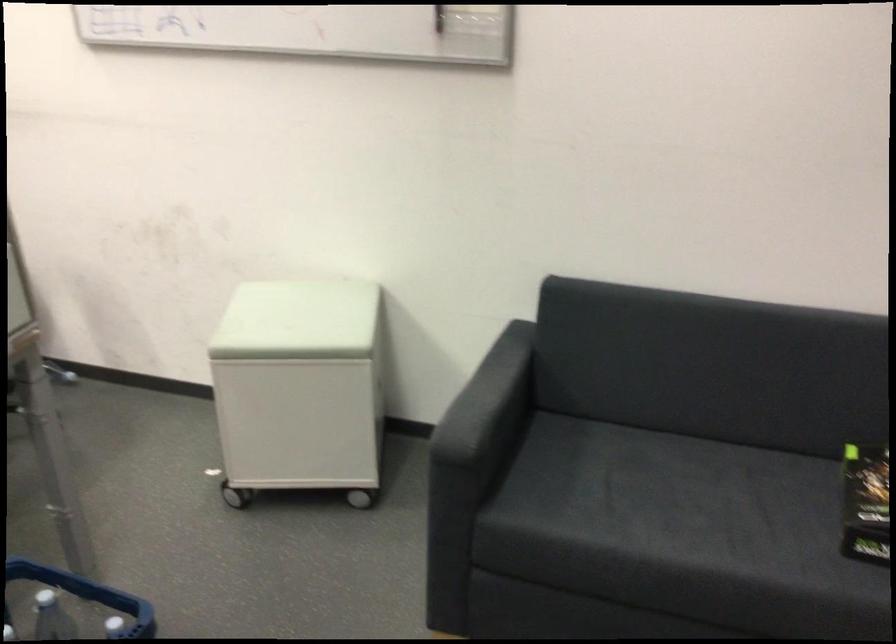
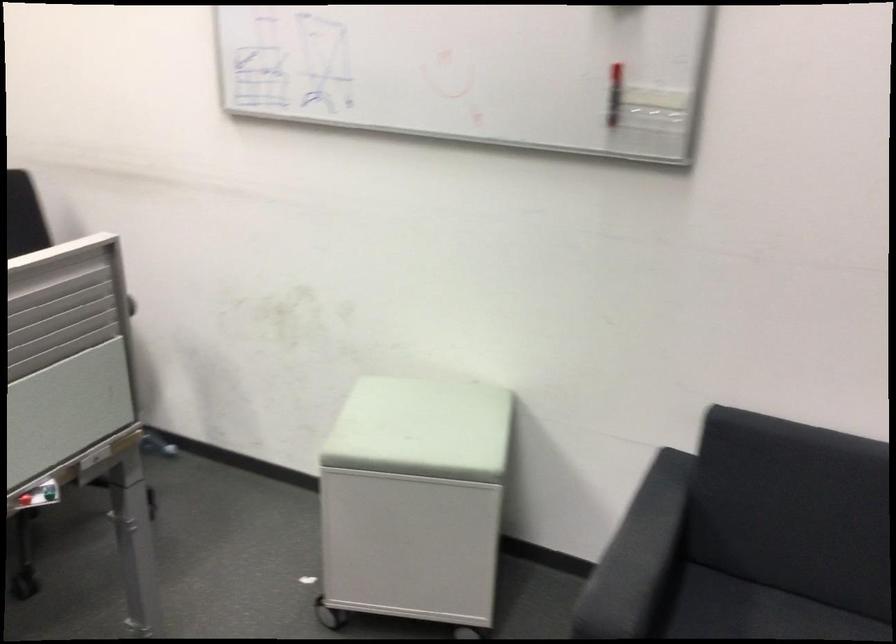
Question: The images are taken continuously from a first-person perspective. In which direction is your viewpoint rotating?

Choices:
 (A) Left
 (B) Right
 (C) Up
 (D) Down

Answer: (A)